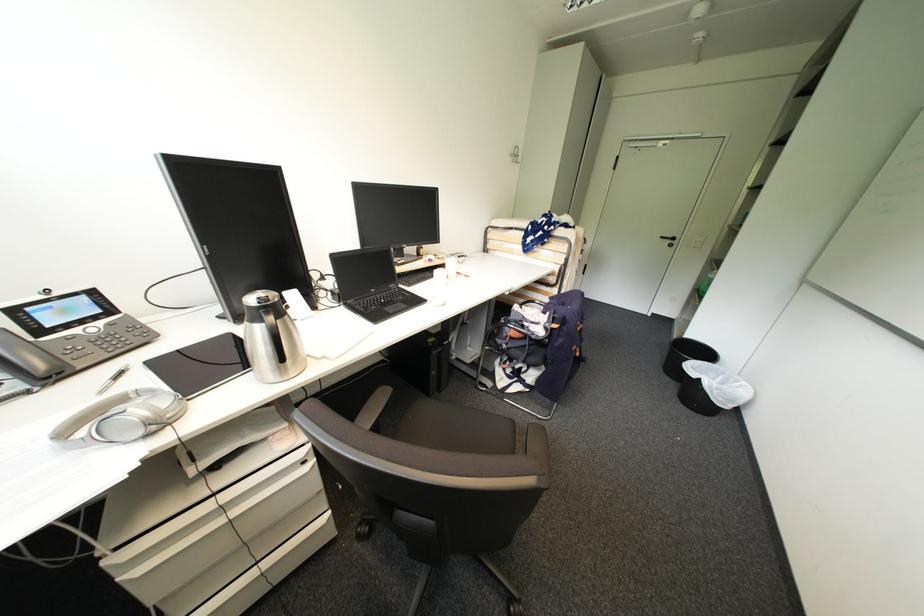
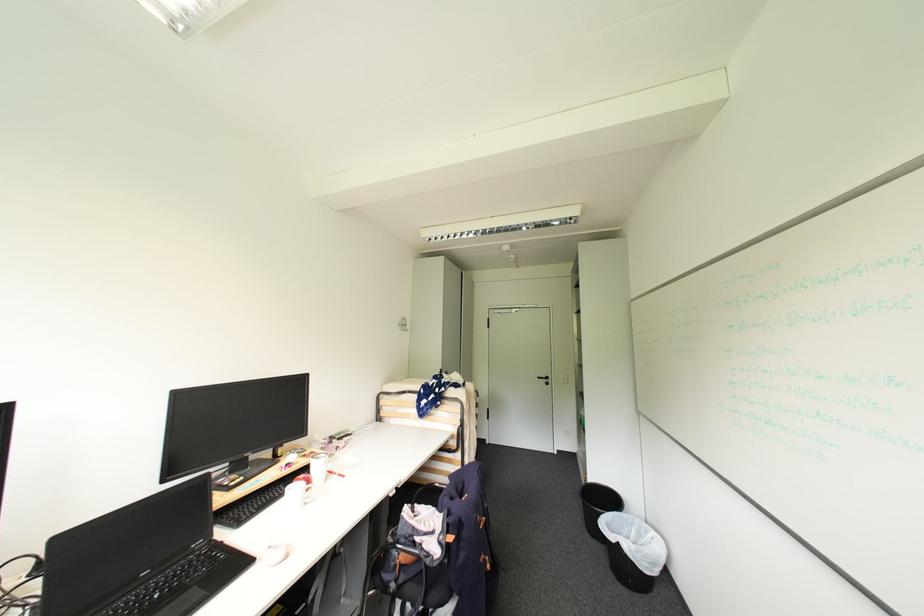
Find the pixel in the second image that matches point 434,277 in the first image.

(286, 495)